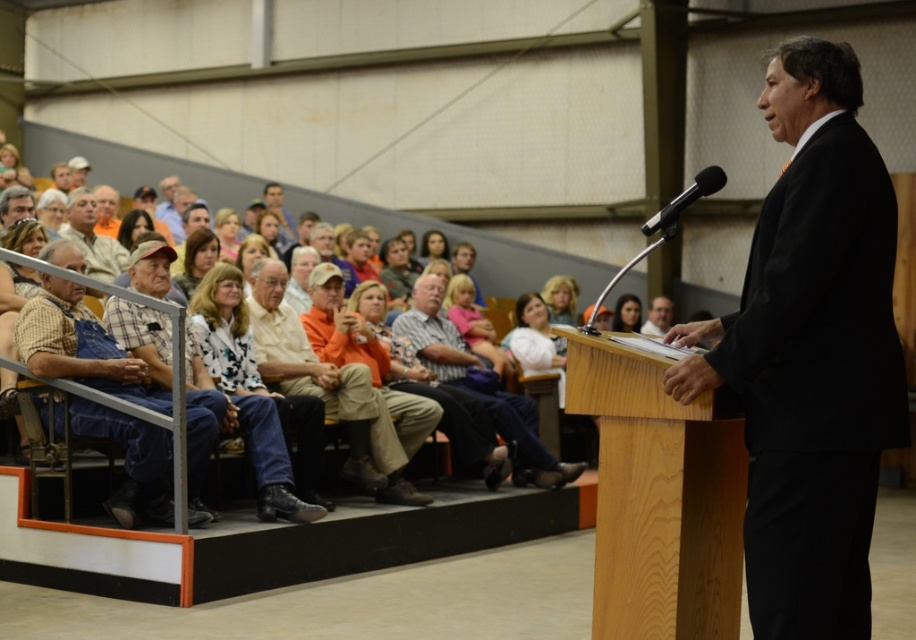
Question: Considering the relative positions of blonde hair at upper center and dark brown hair at upper center in the image provided, where is blonde hair at upper center located with respect to dark brown hair at upper center?

Choices:
 (A) left
 (B) right

Answer: (A)

Question: Which of the following is the closest to the observer?

Choices:
 (A) (107, 192)
 (B) (566, 310)

Answer: (A)

Question: Which is farther from the wooden podium at center?

Choices:
 (A) black suit at center
 (B) light brown leather jacket at upper center

Answer: (B)

Question: Among these points, which one is farthest from the camera?

Choices:
 (A) (557, 484)
 (B) (420, 250)

Answer: (B)

Question: Considering the relative positions of denim overalls at left and matte black suit at center in the image provided, where is denim overalls at left located with respect to matte black suit at center?

Choices:
 (A) left
 (B) right

Answer: (A)

Question: Does black suit at center appear over fluffy white sweater at upper center?

Choices:
 (A) yes
 (B) no

Answer: (B)